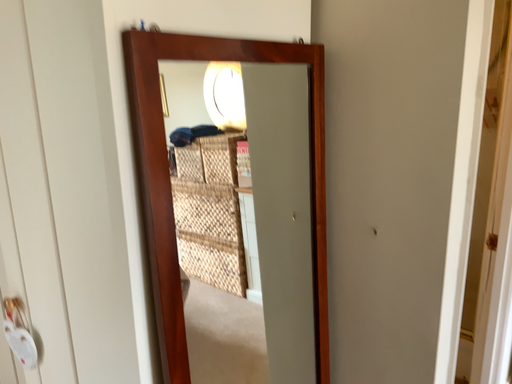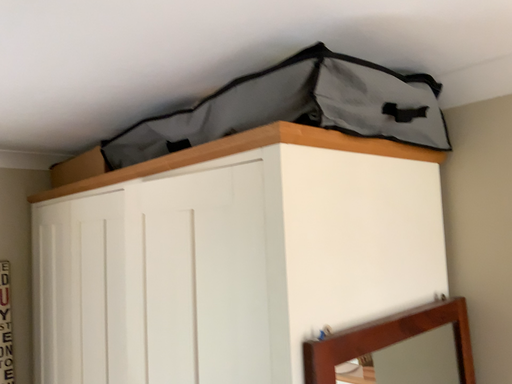
Question: How did the camera likely rotate when shooting the video?

Choices:
 (A) rotated left
 (B) rotated right

Answer: (A)